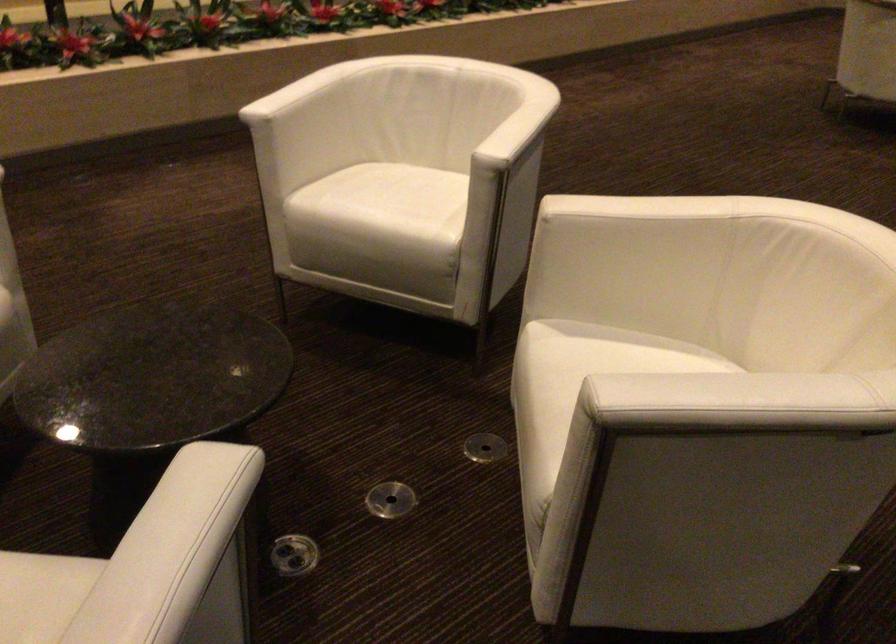
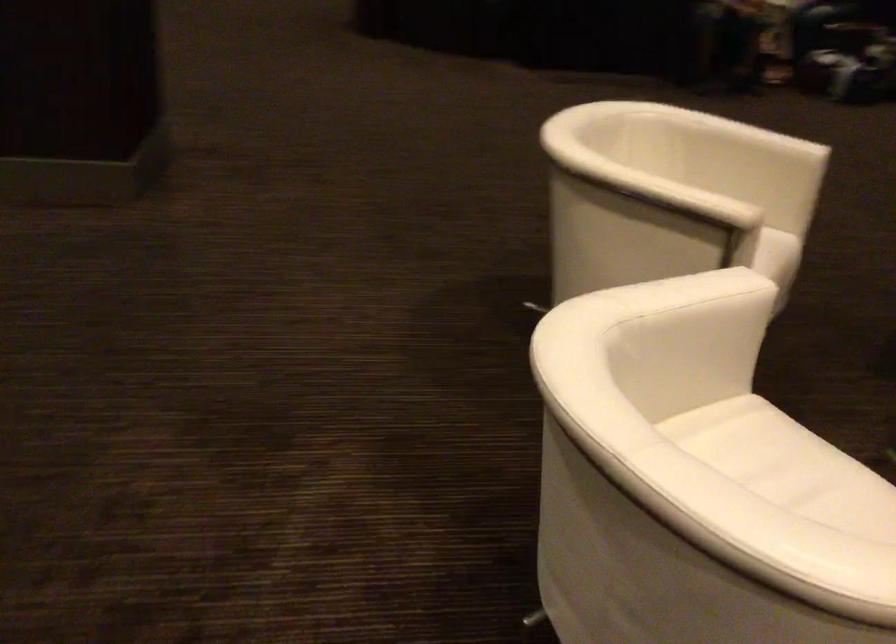
Locate, in the second image, the point that corresponds to [616,202] in the first image.

(675, 194)